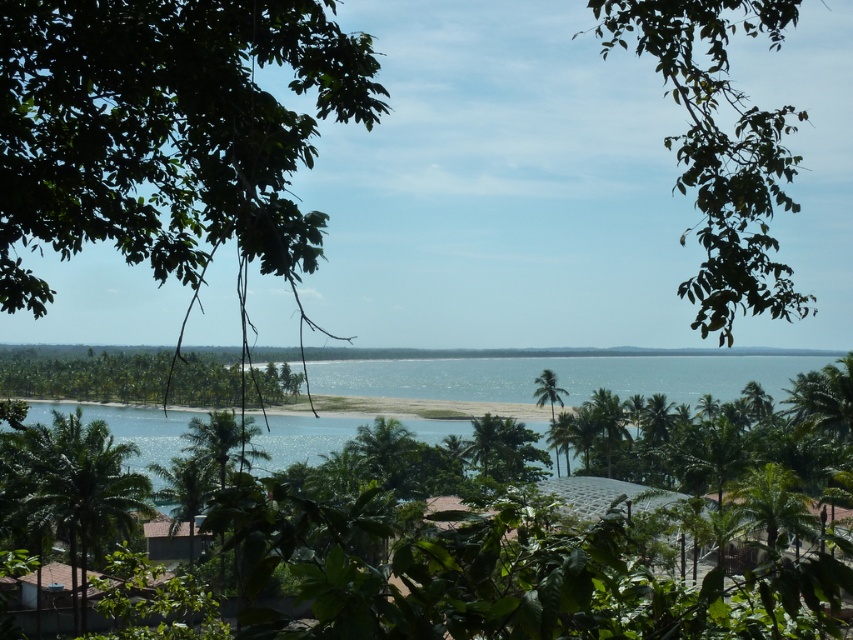
Is point (682, 86) behind point (48, 394)?

That is False.

Locate an element on the screen. green leafy branch at upper right is located at coordinates [x=720, y=147].

From the picture: Does green leafy branch at upper right have a greater width compared to green leafy palm tree at lower left?

Yes.

Between point (753, 266) and point (74, 460), which one is positioned behind?

The point (74, 460) is more distant.

What are the coordinates of `green leafy branch at upper right` in the screenshot? It's located at (x=720, y=147).

Where is `green leafy branch at upper right`? green leafy branch at upper right is located at coordinates (720, 147).

Can you confirm if green leafy palm tree at lower left is thinner than green leafy tree at center?

Yes.

Does point (74, 534) come closer to viewer compared to point (221, 404)?

Yes, it is in front of point (221, 404).

Identify the location of green leafy palm tree at lower left. This screenshot has height=640, width=853. (67, 488).